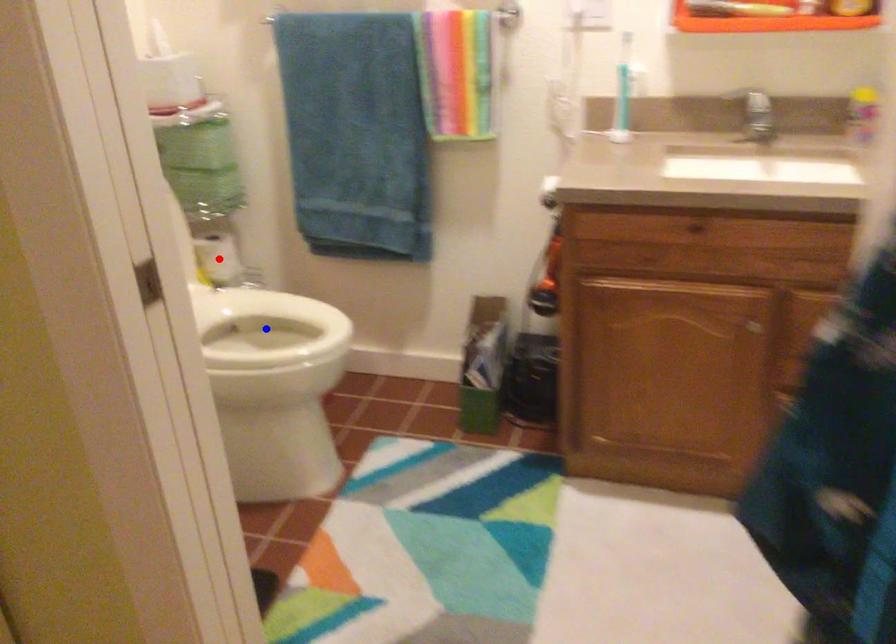
Question: Two points are marked on the image. Which point is closer to the camera?

Choices:
 (A) Blue point is closer.
 (B) Red point is closer.

Answer: (A)